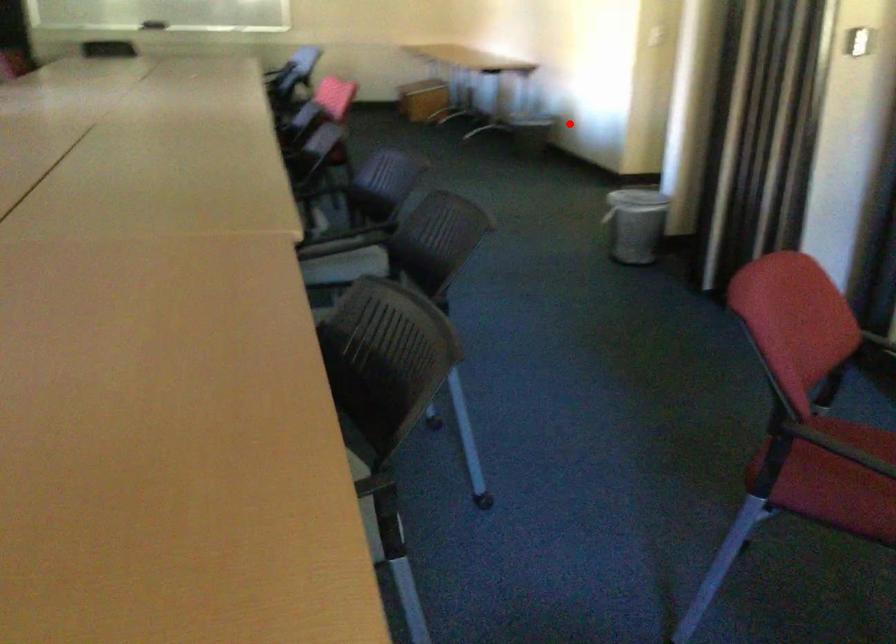
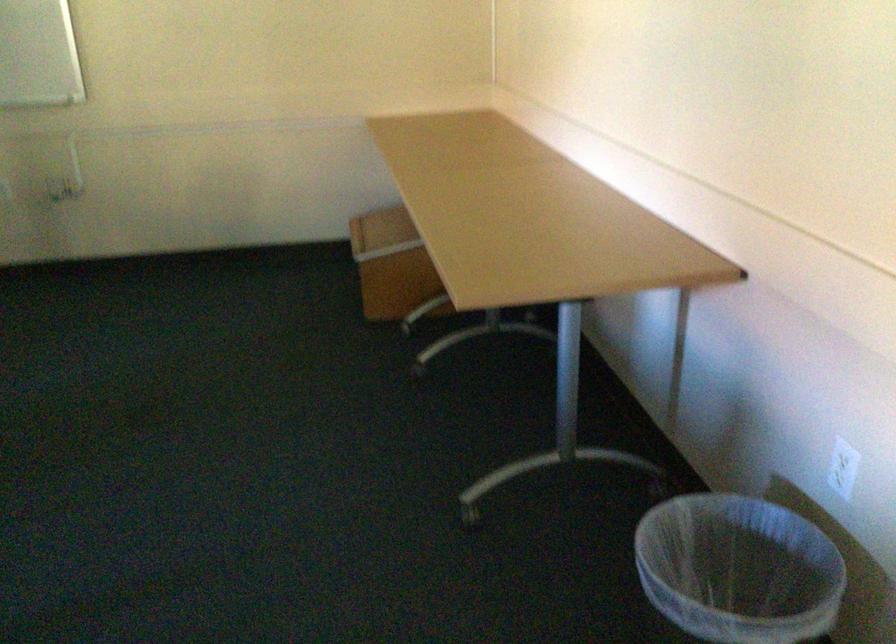
Question: I am providing you with two images of the same scene from different viewpoints. Image1 has a red point marked. In image2, the corresponding 3D location appears at what relative position? Reply with the corresponding letter.

Choices:
 (A) Closer
 (B) Farther

Answer: (A)